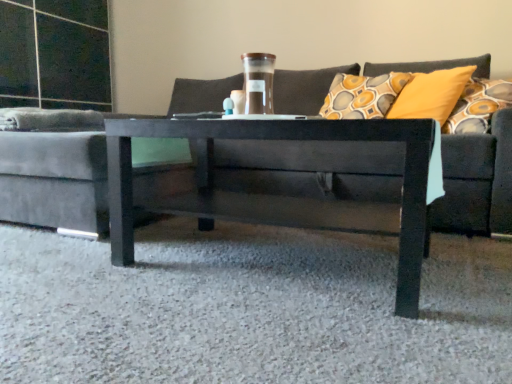
Question: Does dark gray fabric couch at center have a larger size compared to glossy black coffee table at center?

Choices:
 (A) no
 (B) yes

Answer: (B)

Question: From a real-world perspective, does dark gray fabric couch at center stand above glossy black coffee table at center?

Choices:
 (A) yes
 (B) no

Answer: (A)

Question: From a real-world perspective, is dark gray fabric couch at center beneath glossy black coffee table at center?

Choices:
 (A) no
 (B) yes

Answer: (A)

Question: Is dark gray fabric couch at center positioned beyond the bounds of glossy black coffee table at center?

Choices:
 (A) yes
 (B) no

Answer: (A)

Question: Is dark gray fabric couch at center beside glossy black coffee table at center?

Choices:
 (A) yes
 (B) no

Answer: (B)

Question: Considering their positions, is translucent glass jar at center located in front of or behind glossy black coffee table at center?

Choices:
 (A) front
 (B) behind

Answer: (B)

Question: Is translucent glass jar at center bigger or smaller than glossy black coffee table at center?

Choices:
 (A) big
 (B) small

Answer: (B)

Question: Considering the positions of translucent glass jar at center and glossy black coffee table at center in the image, is translucent glass jar at center wider or thinner than glossy black coffee table at center?

Choices:
 (A) wide
 (B) thin

Answer: (B)

Question: Considering the positions of translucent glass jar at center and glossy black coffee table at center in the image, is translucent glass jar at center taller or shorter than glossy black coffee table at center?

Choices:
 (A) short
 (B) tall

Answer: (A)

Question: Which is correct: dark gray fabric couch at center is inside glossy black coffee table at center, or outside of it?

Choices:
 (A) outside
 (B) inside

Answer: (A)

Question: In the image, is dark gray fabric couch at center positioned in front of or behind glossy black coffee table at center?

Choices:
 (A) front
 (B) behind

Answer: (A)

Question: Considering the relative positions of dark gray fabric couch at center and glossy black coffee table at center in the image provided, is dark gray fabric couch at center to the left or to the right of glossy black coffee table at center?

Choices:
 (A) right
 (B) left

Answer: (B)

Question: In terms of width, does dark gray fabric couch at center look wider or thinner when compared to glossy black coffee table at center?

Choices:
 (A) wide
 (B) thin

Answer: (A)

Question: From a real-world perspective, is translucent glass jar at center above or below dark gray fabric couch at center?

Choices:
 (A) above
 (B) below

Answer: (A)

Question: Considering the positions of translucent glass jar at center and dark gray fabric couch at center in the image, is translucent glass jar at center taller or shorter than dark gray fabric couch at center?

Choices:
 (A) tall
 (B) short

Answer: (B)